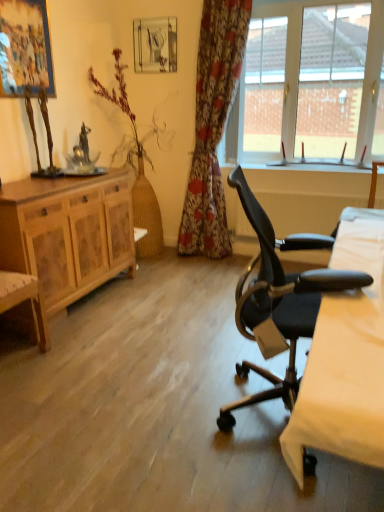
Question: From a real-world perspective, relative to wooden cabinet at left, is black leather office chair at right vertically above or below?

Choices:
 (A) below
 (B) above

Answer: (B)

Question: Considering the positions of black leather office chair at right and wooden cabinet at left in the image, is black leather office chair at right taller or shorter than wooden cabinet at left?

Choices:
 (A) tall
 (B) short

Answer: (A)

Question: Which object is the farthest from the bare wood vase at left?

Choices:
 (A) metallic glass picture frame at upper center, the second picture frame from the front
 (B) white glass window at upper right
 (C) black leather office chair at right
 (D) wooden cabinet at left
 (E) matte wooden picture frame at upper left, which is counted as the first picture frame, starting from the front

Answer: (B)

Question: Estimate the real-world distances between objects in this image. Which object is farther from the bare wood vase at left?

Choices:
 (A) metallic glass picture frame at upper center, acting as the first picture frame starting from the right
 (B) black leather office chair at right
 (C) white glass window at upper right
 (D) wooden cabinet at left
 (E) matte wooden picture frame at upper left, the second picture frame when ordered from right to left

Answer: (C)